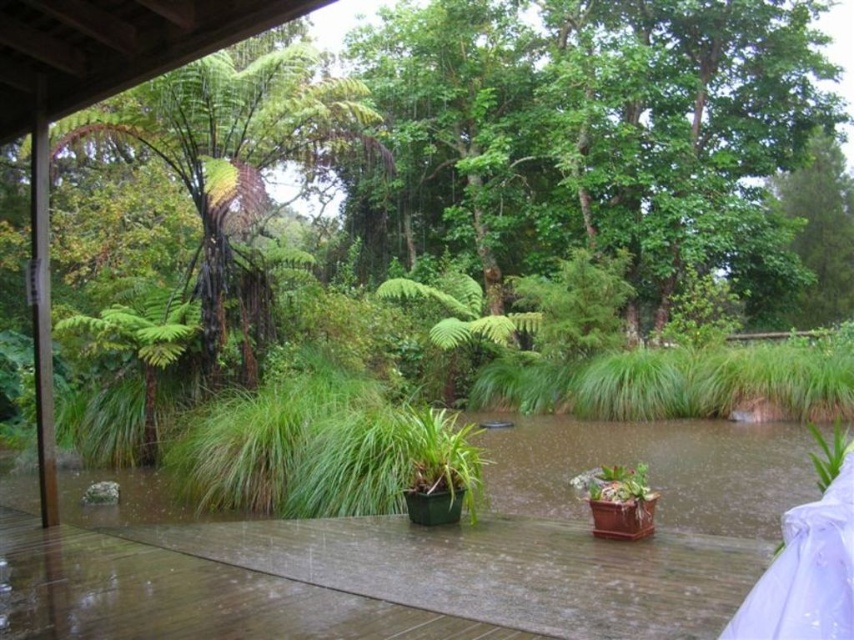
Question: Is green leafy tree at upper center behind brown wooden deck at center?

Choices:
 (A) yes
 (B) no

Answer: (A)

Question: Which point is farther to the camera?

Choices:
 (A) green leafy tree at left
 (B) brown wooden deck at center
 (C) green leafy tree at upper center

Answer: (C)

Question: Can you confirm if green leafy tree at upper center is smaller than brown wooden deck at center?

Choices:
 (A) no
 (B) yes

Answer: (A)

Question: Does brown wooden deck at center appear on the right side of green leafy tree at left?

Choices:
 (A) yes
 (B) no

Answer: (B)

Question: Which point is closer to the camera?

Choices:
 (A) (344, 106)
 (B) (788, 32)

Answer: (A)

Question: Among these objects, which one is nearest to the camera?

Choices:
 (A) brown wooden deck at center
 (B) green leafy tree at upper center
 (C) green leafy tree at left

Answer: (A)